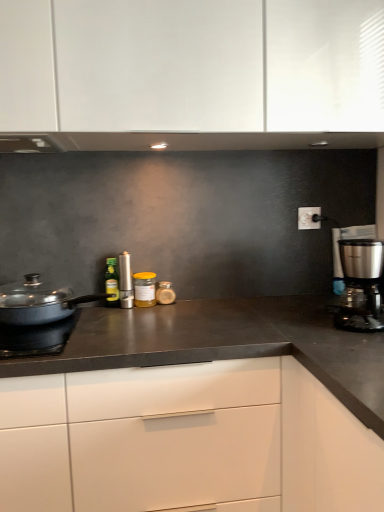
The image size is (384, 512). Identify the location of free point below matte black pan at left (from a real-world perspective). (76, 320).